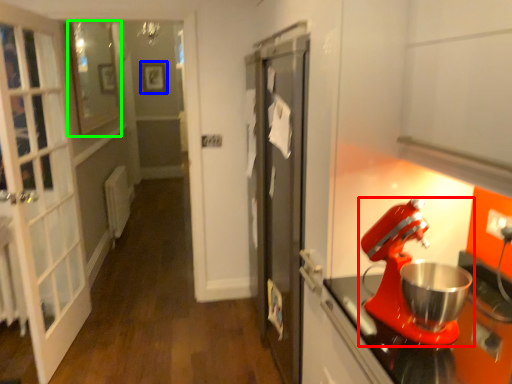
Question: Which object is positioned farthest from mixer (highlighted by a red box)? Select from picture frame (highlighted by a blue box) and window (highlighted by a green box).

Choices:
 (A) picture frame
 (B) window

Answer: (A)